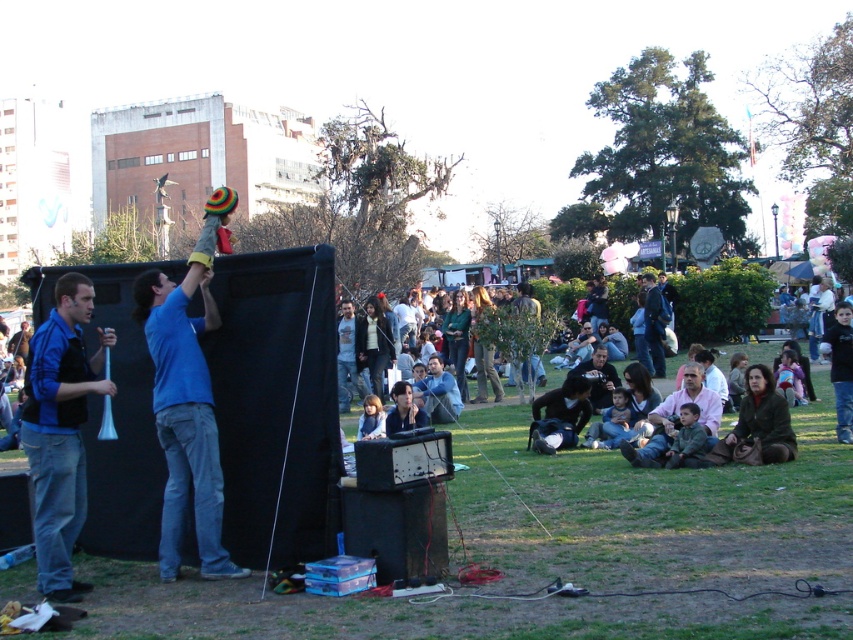
Is blue fabric megaphone at left wider than dark brown leather jacket at center?

In fact, blue fabric megaphone at left might be narrower than dark brown leather jacket at center.

Which is behind, point (50, 524) or point (682, 356)?

Point (682, 356)

Where is `blue fabric megaphone at left`? blue fabric megaphone at left is located at coordinates (61, 429).

The height and width of the screenshot is (640, 853). I want to click on blue fabric hat at upper left, so click(x=187, y=400).

Find the location of a particular element. This screenshot has height=640, width=853. blue fabric hat at upper left is located at coordinates (187, 400).

Can you confirm if blue fabric hat at upper left is positioned to the left of blue fabric megaphone at left?

No, blue fabric hat at upper left is not to the left of blue fabric megaphone at left.

Can you confirm if blue fabric hat at upper left is positioned below blue fabric megaphone at left?

Incorrect, blue fabric hat at upper left is not positioned below blue fabric megaphone at left.

Where is `blue fabric hat at upper left`? blue fabric hat at upper left is located at coordinates (187, 400).